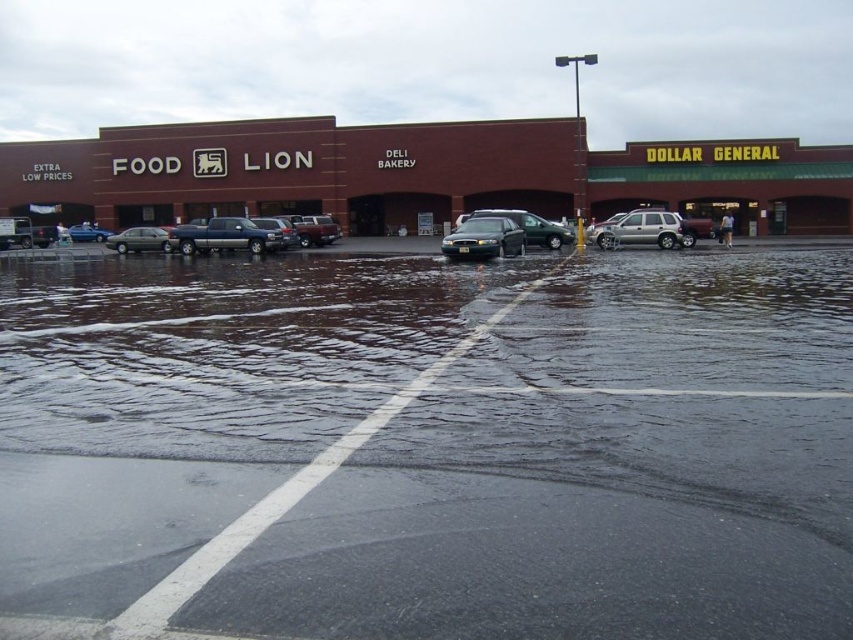
You are a delivery driver who needs to park your satin black sedan at center in the parking lot. The parking lot has a white painted line marking the edge. Can you safely park your vehicle on the parking lot without going over the white line?

Result: The satin black sedan at center is located at coordinates [485,237], which is within the parking area and not crossing the white line marking the edge. Therefore, it can be parked safely without crossing the line.

You are driving a car and need to park in the parking lot. You see a matte gray sedan at left and a satin silver sedan at center. Which car is closer to the Food Lion store on the left side?

The matte gray sedan at left is closer to the Food Lion store on the left side because it is positioned to the left of the satin silver sedan at center, which is closer to the center of the parking lot.

You are standing at the edge of the parking lot and see two points marked in the image. Which point is closer to you, point (502, 228) or point (645, 227)?

Point (502, 228) is in front of point (645, 227), so it is closer to you.